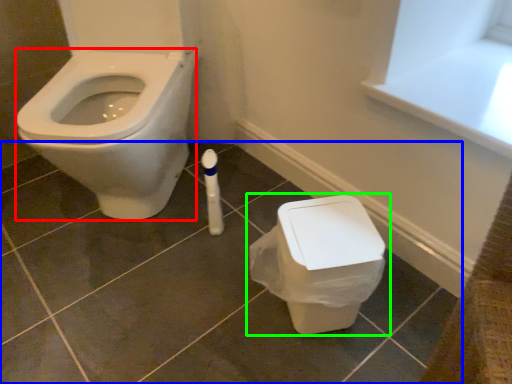
Question: Which is nearer to the bidet (highlighted by a red box)? tile (highlighted by a blue box) or toilet (highlighted by a green box).

Choices:
 (A) tile
 (B) toilet

Answer: (A)